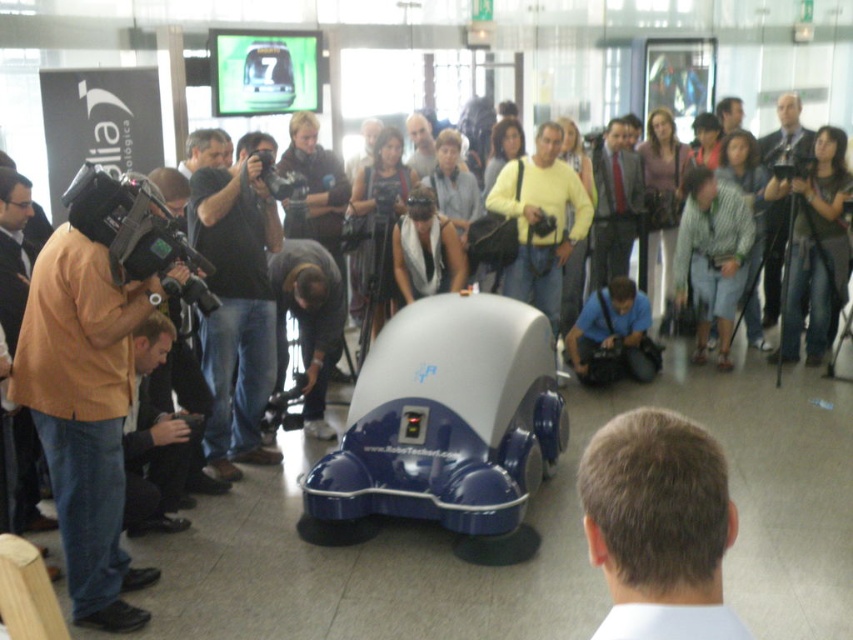
Which of these two, brown leather jacket at left or black fabric camera at left, stands taller?

black fabric camera at left is taller.

Is point (51, 401) positioned in front of point (256, 240)?

That is True.

Is point (74, 476) farther from viewer compared to point (236, 426)?

That is False.

Find the location of a particular element. brown leather jacket at left is located at coordinates (84, 413).

Who is higher up, black fabric camera at left or light brown leather jacket at upper center?

light brown leather jacket at upper center

I want to click on black fabric camera at left, so click(236, 308).

Measure the distance between black fabric camera at left and camera.

A distance of 4.42 meters exists between black fabric camera at left and camera.

Find the location of a particular element. The height and width of the screenshot is (640, 853). black fabric camera at left is located at coordinates (236, 308).

Is blue glossy toy car at center bigger than light brown leather jacket at upper center?

Correct, blue glossy toy car at center is larger in size than light brown leather jacket at upper center.

Which of these two, blue glossy toy car at center or light brown leather jacket at upper center, stands shorter?

With less height is light brown leather jacket at upper center.

Is point (427, 433) in front of point (770, 280)?

Yes, point (427, 433) is in front of point (770, 280).

This screenshot has width=853, height=640. I want to click on blue glossy toy car at center, so click(444, 422).